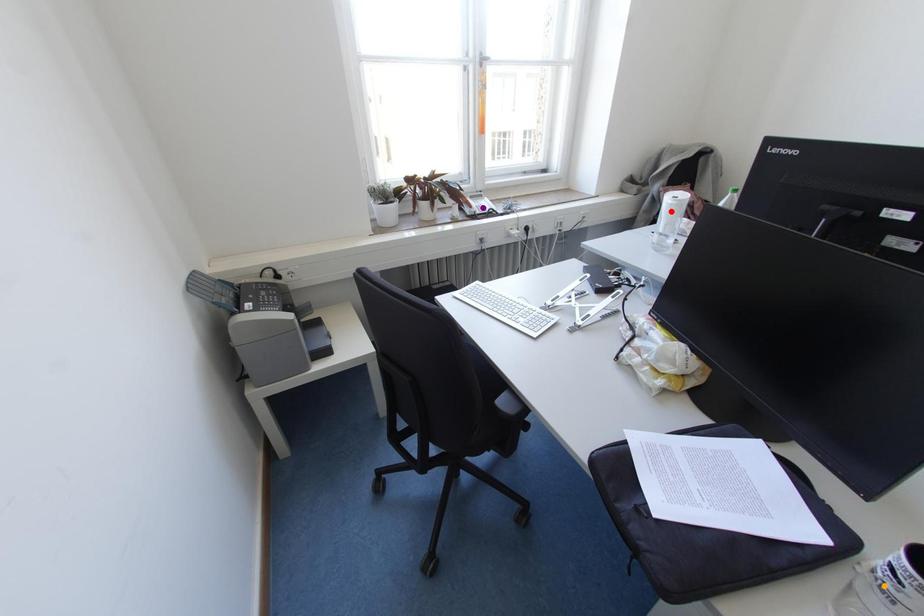
Order these from nearest to farthest:
orange point
red point
purple point

1. orange point
2. red point
3. purple point